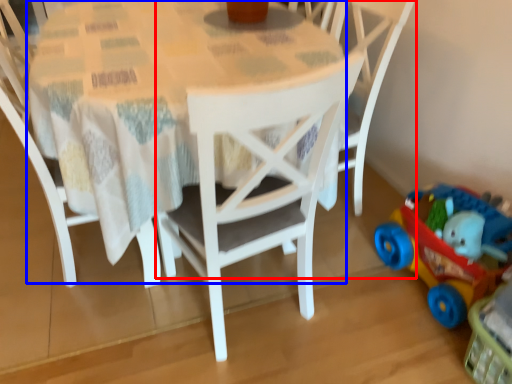
Question: Among these objects, which one is farthest to the camera, chair (highlighted by a red box) or round table (highlighted by a blue box)?

Choices:
 (A) chair
 (B) round table

Answer: (A)